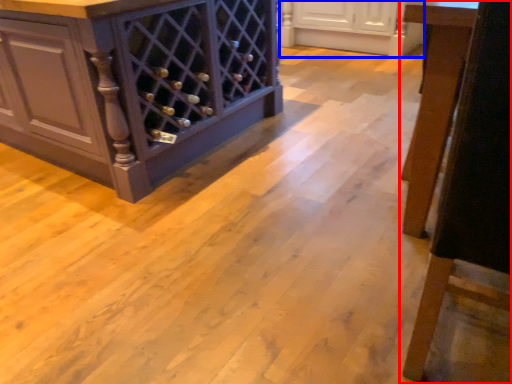
Question: Which of the following is the farthest to the observer, furniture (highlighted by a red box) or cabinetry (highlighted by a blue box)?

Choices:
 (A) furniture
 (B) cabinetry

Answer: (B)